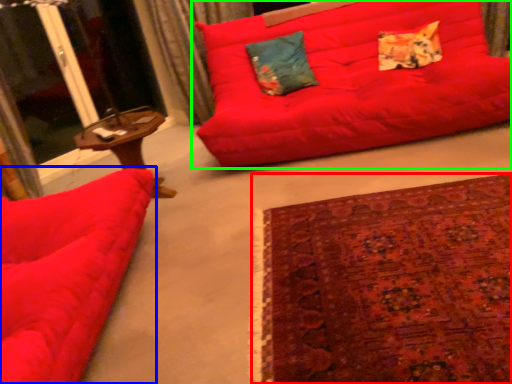
Question: Which object is positioned farthest from plain (highlighted by a red box)? Select from studio couch (highlighted by a blue box) and studio couch (highlighted by a green box).

Choices:
 (A) studio couch
 (B) studio couch

Answer: (B)